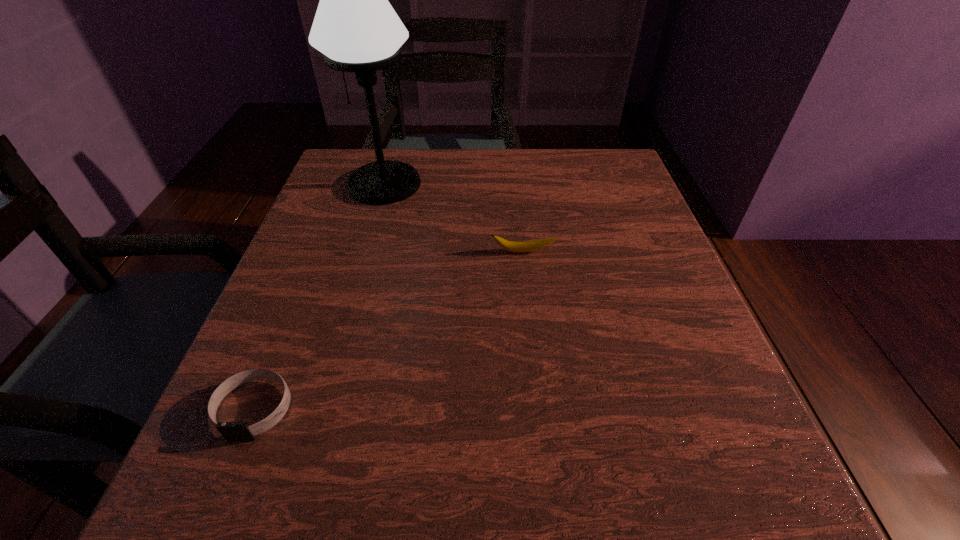
At what (x,y) coordinates should I click in order to perform the action: click on wristband present at the left edge. Please return your answer as a coordinate pair (x, y). Image resolution: width=960 pixels, height=540 pixels. Looking at the image, I should click on (229, 430).

Locate an element on the screen. Image resolution: width=960 pixels, height=540 pixels. object that is at the far left corner is located at coordinates (355, 27).

At what (x,y) coordinates should I click in order to perform the action: click on free point at the far edge. Please return your answer as a coordinate pair (x, y). Looking at the image, I should click on (544, 199).

Locate an element on the screen. The width and height of the screenshot is (960, 540). vacant point at the left edge is located at coordinates (283, 443).

The width and height of the screenshot is (960, 540). Identify the location of free point at the right edge. (681, 327).

In the image, there is a desktop. Where is `vacant region at the far left corner`? vacant region at the far left corner is located at coordinates (340, 197).

I want to click on vacant region at the far right corner of the desktop, so coord(616,168).

This screenshot has height=540, width=960. Identify the location of free space between the nearest object and the second nearest object. (389, 330).

You are a GUI agent. You are given a task and a screenshot of the screen. Output one action in this format:
    pyautogui.click(x=<x>, y=<y>)
    Task: Click on the empty space that is in between the rightmost object and the nearest object
    Image resolution: width=960 pixels, height=540 pixels.
    Given the screenshot: What is the action you would take?
    pyautogui.click(x=389, y=330)

Where is `free spot between the table lamp and the banana`? The height and width of the screenshot is (540, 960). free spot between the table lamp and the banana is located at coordinates (454, 218).